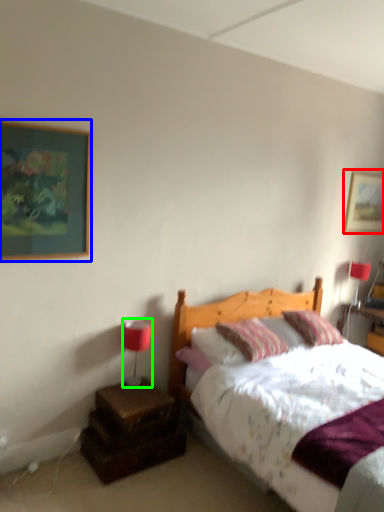
Question: Based on their relative distances, which object is nearer to picture frame (highlighted by a red box)? Choose from picture frame (highlighted by a blue box) and table lamp (highlighted by a green box).

Choices:
 (A) picture frame
 (B) table lamp

Answer: (B)